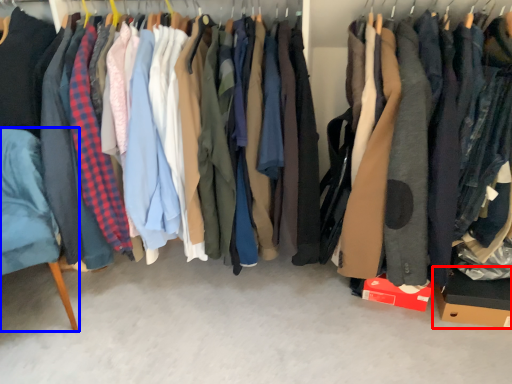
Question: Which object appears farthest to the camera in this image, cardboard box (highlighted by a red box) or furniture (highlighted by a blue box)?

Choices:
 (A) cardboard box
 (B) furniture

Answer: (A)